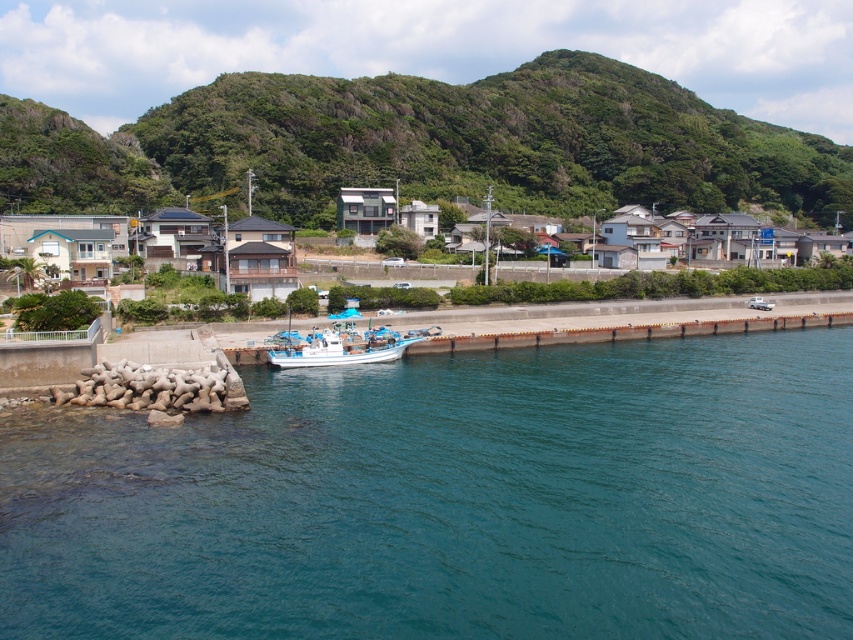
Is teal water at lower center further to camera compared to white plastic boat at center?

No.

Which is more to the left, teal water at lower center or white plastic boat at center?

Positioned to the left is white plastic boat at center.

This screenshot has height=640, width=853. Describe the element at coordinates (451, 499) in the screenshot. I see `teal water at lower center` at that location.

Where is `teal water at lower center`? The image size is (853, 640). teal water at lower center is located at coordinates (451, 499).

Which is in front, point (109, 572) or point (366, 81)?

Point (109, 572)

Does teal water at lower center have a lesser height compared to green leafy hillside at upper center?

Yes, teal water at lower center is shorter than green leafy hillside at upper center.

Who is more forward, (135, 632) or (561, 83)?

Point (135, 632) is in front.

This screenshot has height=640, width=853. Identify the location of teal water at lower center. (451, 499).

Looking at this image, who is positioned more to the left, concrete dock at center or white plastic boat at center?

From the viewer's perspective, white plastic boat at center appears more on the left side.

Which is behind, point (572, 336) or point (334, 362)?

Positioned behind is point (572, 336).

Is point (703, 324) closer to camera compared to point (305, 353)?

No, it is behind (305, 353).

The image size is (853, 640). I want to click on concrete dock at center, so click(x=624, y=332).